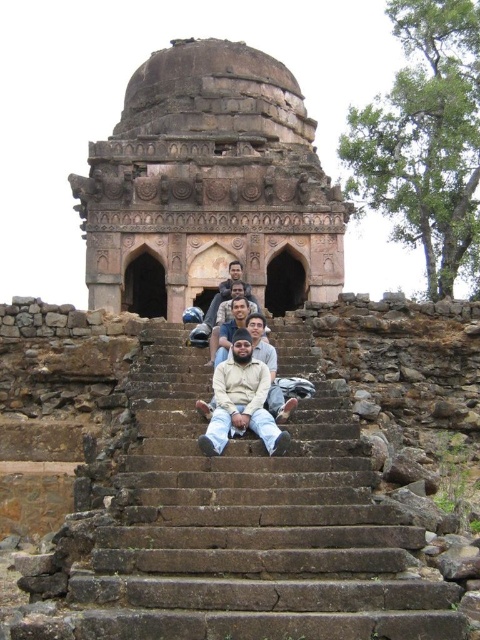
You are standing on the brown stone stairs at center and want to reach the beige cotton shirt at center. Which direction should you move?

The beige cotton shirt at center is above the brown stone stairs at center, so you should move upward to reach it.

You are a tour guide leading a group to the rustic stone dome at center. The brown stone stairs at center are the only path to reach it. Can you confirm if the stairs are wide enough for the group to climb comfortably?

The brown stone stairs at center has a smaller size compared to rustic stone dome at center, so the stairs may be narrower and might not be wide enough for the group to climb comfortably.